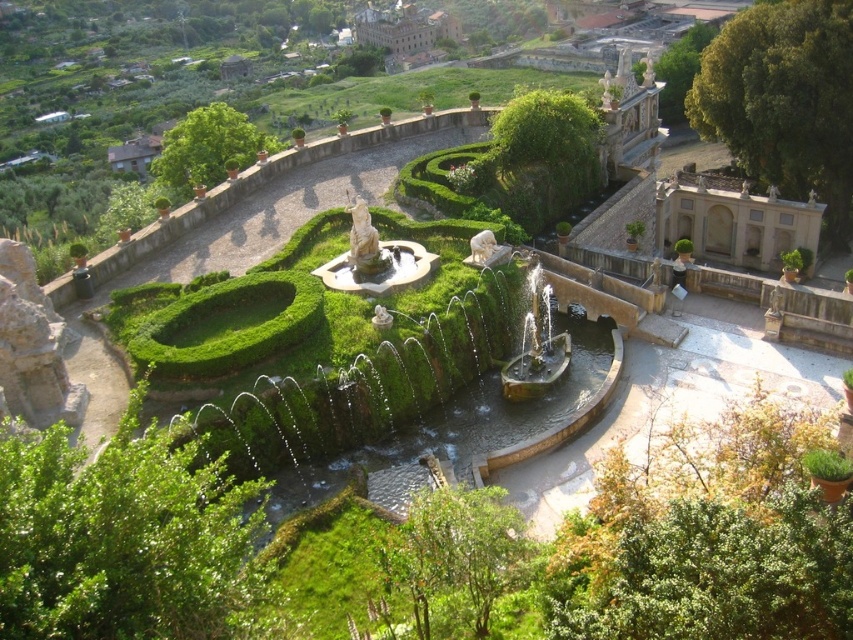
You are standing in the garden and want to take a photo of both the green leafy bush at lower left and the brown stone palace at upper center. Which object should you focus on first to ensure both are in clear view?

You should focus on the green leafy bush at lower left first because it is closer to you than the brown stone palace at upper center. By focusing on the closer object, the palace will also be in focus due to the depth of field.

You are standing in the garden and want to take a photo of both the green leafy bush at lower left and the brown stone palace at upper center. Which object will appear smaller in the photo?

The green leafy bush at lower left will appear smaller in the photo because it is shorter than the brown stone palace at upper center.